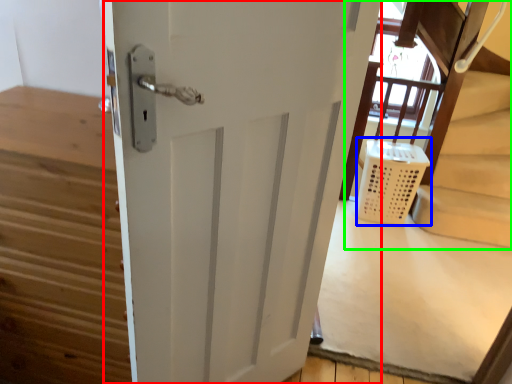
Question: Estimate the real-world distances between objects in this image. Which object is farther from door (highlighted by a red box), laundry basket (highlighted by a blue box) or bunk bed (highlighted by a green box)?

Choices:
 (A) laundry basket
 (B) bunk bed

Answer: (B)